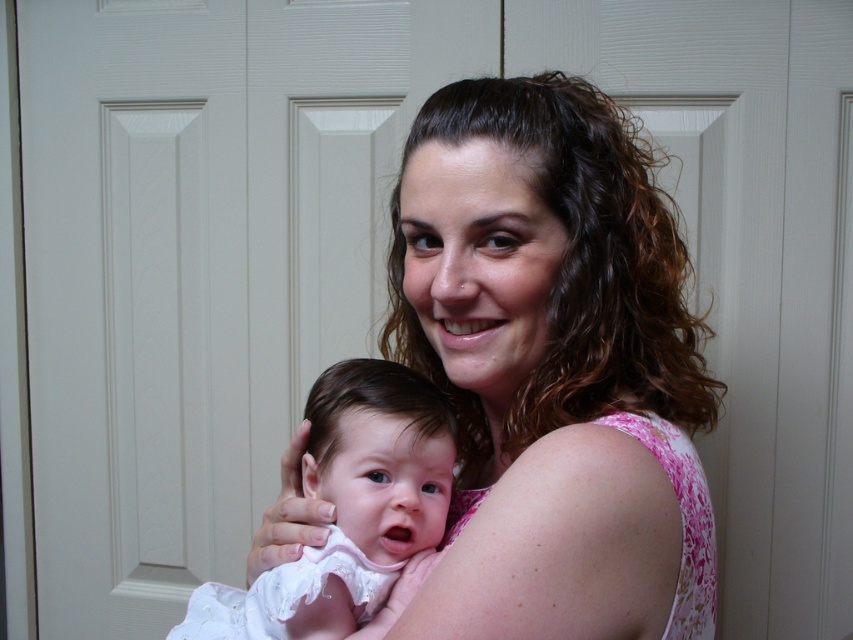
Is pink floral dress at center shorter than white soft fabric baby at center?

Incorrect, pink floral dress at center's height does not fall short of white soft fabric baby at center's.

From the picture: Which is below, pink floral dress at center or white soft fabric baby at center?

Positioned lower is white soft fabric baby at center.

The height and width of the screenshot is (640, 853). Find the location of `pink floral dress at center`. pink floral dress at center is located at coordinates (554, 368).

Find the location of a particular element. Image resolution: width=853 pixels, height=640 pixels. pink floral dress at center is located at coordinates (554, 368).